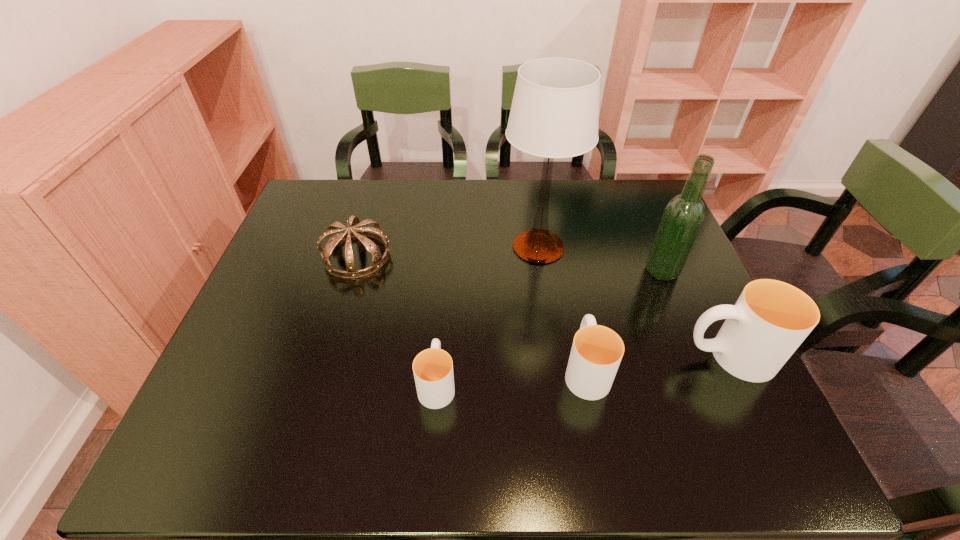
Identify the location of vacant space located with the handle on the side of the leftmost cup. point(444,288).

Locate an element on the screen. vacant space located 0.170m with the handle on the side of the second tallest cup is located at coordinates (570, 288).

Identify the location of free space located with the handle on the side of the second tallest cup. The height and width of the screenshot is (540, 960). (567, 276).

Locate an element on the screen. This screenshot has height=540, width=960. free spot located with the handle on the side of the second tallest cup is located at coordinates (560, 235).

Find the location of a particular element. This screenshot has height=540, width=960. vacant region located with the handle on the side of the tallest cup is located at coordinates [x=573, y=356].

Identify the location of free space located with the handle on the side of the tallest cup. This screenshot has height=540, width=960. (551, 356).

The width and height of the screenshot is (960, 540). I want to click on vacant space located with the handle on the side of the tallest cup, so click(x=501, y=356).

At what (x,y) coordinates should I click in order to perform the action: click on vacant region located 0.060m on the right of the tiara. Please return your answer as a coordinate pair (x, y). This screenshot has height=540, width=960. Looking at the image, I should click on click(413, 256).

Find the location of a particular element. Image resolution: width=960 pixels, height=540 pixels. vacant region located 0.180m on the back of the fifth shortest object is located at coordinates (640, 219).

What are the coordinates of `free space located above the cylindrical shade of the table lamp` in the screenshot? It's located at (548, 320).